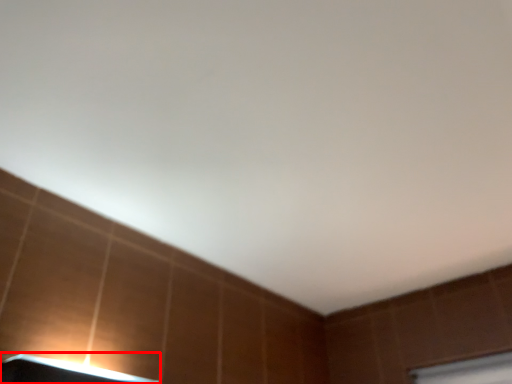
Question: Observing the image, what is the correct spatial positioning of lamp (annotated by the red box) in reference to window frame?

Choices:
 (A) right
 (B) left

Answer: (B)